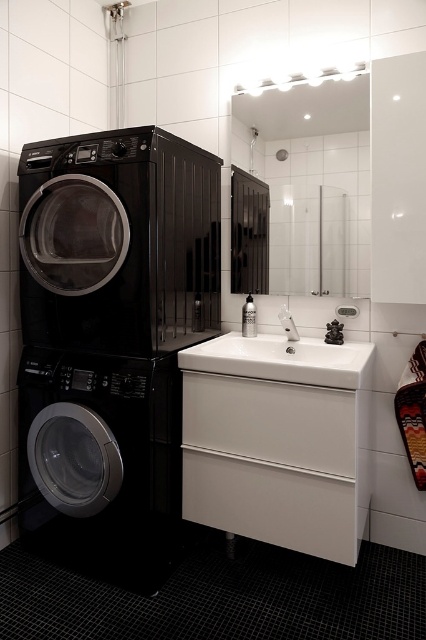
Question: Is white matte drawer at lower center to the right of satin nickel faucet at sink center from the viewer's perspective?

Choices:
 (A) no
 (B) yes

Answer: (A)

Question: Does white matte drawer at lower center come behind white matte drawer at center?

Choices:
 (A) yes
 (B) no

Answer: (A)

Question: Which point is closer to the camera?

Choices:
 (A) white matte drawer at center
 (B) black matte washing machine at left
 (C) white glossy sink at center
 (D) white matte drawer at lower center

Answer: (C)

Question: Which point is closer to the camera?

Choices:
 (A) black glossy washing machine at left
 (B) white matte drawer at center
 (C) white glossy sink at center

Answer: (C)

Question: Is black glossy washing machine at left further to the viewer compared to white matte drawer at lower center?

Choices:
 (A) yes
 (B) no

Answer: (A)

Question: Which point is farther from the camera taking this photo?

Choices:
 (A) (170, 428)
 (B) (357, 545)
 (C) (129, 218)
 (D) (356, 436)

Answer: (A)